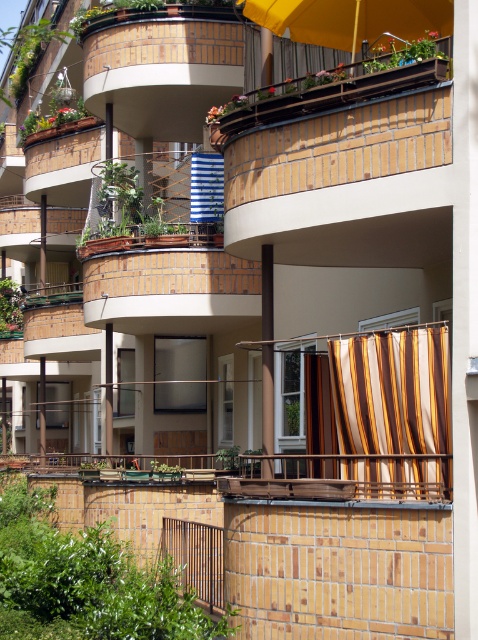
Which is more to the left, wooden railing at upper center or blue striped fabric at upper center?

From the viewer's perspective, blue striped fabric at upper center appears more on the left side.

Describe the element at coordinates (337, 84) in the screenshot. I see `wooden railing at upper center` at that location.

Who is more distant from viewer, [232,120] or [195,161]?

Point [195,161]

This screenshot has height=640, width=478. Find the location of `wooden railing at upper center`. wooden railing at upper center is located at coordinates (337, 84).

Does point (327, 464) come closer to viewer compared to point (217, 198)?

Yes.

Does brown striped curtain at center have a lesser width compared to blue striped fabric at upper center?

Correct, brown striped curtain at center's width is less than blue striped fabric at upper center's.

In order to click on brown striped curtain at center in this screenshot , I will do `click(318, 406)`.

Identify the location of brown striped curtain at center. This screenshot has width=478, height=640. (318, 406).

Consider the image. Is striped fabric curtain at lower right positioned at the back of blue striped fabric at upper center?

No, it is in front of blue striped fabric at upper center.

How much distance is there between striped fabric curtain at lower right and blue striped fabric at upper center?

striped fabric curtain at lower right is 12.59 meters away from blue striped fabric at upper center.

Is point (400, 465) behind point (210, 164)?

No, (400, 465) is in front of (210, 164).

Locate an element on the screen. The width and height of the screenshot is (478, 640). striped fabric curtain at lower right is located at coordinates (393, 412).